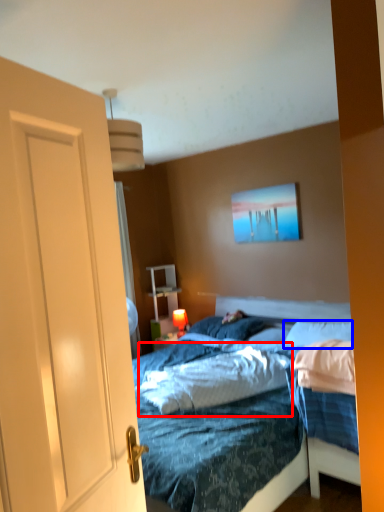
Question: Among these objects, which one is farthest to the camera, mattress (highlighted by a red box) or pillow (highlighted by a blue box)?

Choices:
 (A) mattress
 (B) pillow

Answer: (B)